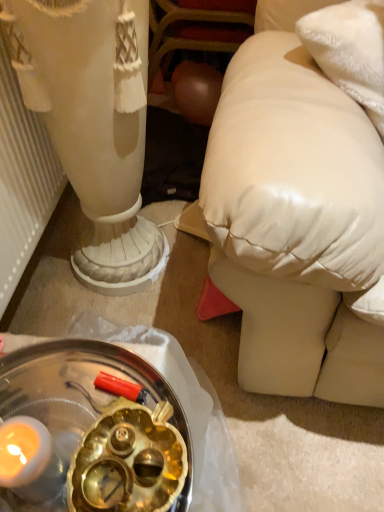
Locate an element on the screen. This screenshot has width=384, height=512. shiny metallic tray at lower left is located at coordinates (98, 430).

Measure the distance between shiny metallic tray at lower left and camera.

The depth of shiny metallic tray at lower left is 18.70 inches.

The image size is (384, 512). What do you see at coordinates (98, 430) in the screenshot?
I see `shiny metallic tray at lower left` at bounding box center [98, 430].

Measure the distance between satin white vase at center and camera.

satin white vase at center is 68.12 centimeters from camera.

Describe the element at coordinates (93, 123) in the screenshot. I see `satin white vase at center` at that location.

Image resolution: width=384 pixels, height=512 pixels. I want to click on satin white vase at center, so click(x=93, y=123).

Locate an element on the screen. This screenshot has width=384, height=512. shiny metallic tray at lower left is located at coordinates (98, 430).

Is shiny metallic tray at lower left at the left side of satin white vase at center?

No, shiny metallic tray at lower left is not to the left of satin white vase at center.

Which object is further away from the camera taking this photo, shiny metallic tray at lower left or satin white vase at center?

satin white vase at center is behind.

Which is behind, point (29, 367) or point (43, 115)?

Positioned behind is point (43, 115).

From the picture: From the image's perspective, does shiny metallic tray at lower left appear lower than satin white vase at center?

Correct, shiny metallic tray at lower left appears lower than satin white vase at center in the image.

From a real-world perspective, who is located higher, shiny metallic tray at lower left or satin white vase at center?

shiny metallic tray at lower left.

Considering the relative sizes of shiny metallic tray at lower left and satin white vase at center in the image provided, is shiny metallic tray at lower left thinner than satin white vase at center?

Yes.

Considering the sizes of objects shiny metallic tray at lower left and satin white vase at center in the image provided, who is shorter, shiny metallic tray at lower left or satin white vase at center?

With less height is shiny metallic tray at lower left.

Between shiny metallic tray at lower left and satin white vase at center, which one has larger size?

satin white vase at center is bigger.

In the scene shown: Is shiny metallic tray at lower left not within satin white vase at center?

Yes, shiny metallic tray at lower left is located beyond the bounds of satin white vase at center.

Is shiny metallic tray at lower left next to satin white vase at center and touching it?

shiny metallic tray at lower left and satin white vase at center are clearly separated.

Looking at this image, is shiny metallic tray at lower left aimed at satin white vase at center?

No, shiny metallic tray at lower left is not facing towards satin white vase at center.

Identify the location of sculpture on the left of shiny metallic tray at lower left. The height and width of the screenshot is (512, 384). (93, 123).

Visually, is satin white vase at center positioned to the left or to the right of shiny metallic tray at lower left?

Based on their positions, satin white vase at center is located to the left of shiny metallic tray at lower left.

Considering their positions, is satin white vase at center located in front of or behind shiny metallic tray at lower left?

satin white vase at center is behind shiny metallic tray at lower left.

Is point (96, 173) farther from camera compared to point (50, 403)?

Yes.

From the image's perspective, is satin white vase at center above shiny metallic tray at lower left?

Correct, satin white vase at center appears higher than shiny metallic tray at lower left in the image.

From a real-world perspective, between satin white vase at center and shiny metallic tray at lower left, who is vertically higher?

From a 3D spatial view, shiny metallic tray at lower left is above.

Which object is thinner, satin white vase at center or shiny metallic tray at lower left?

shiny metallic tray at lower left is thinner.

Does satin white vase at center have a lesser height compared to shiny metallic tray at lower left?

In fact, satin white vase at center may be taller than shiny metallic tray at lower left.

Can you confirm if satin white vase at center is bigger than shiny metallic tray at lower left?

Yes.

Is satin white vase at center surrounding shiny metallic tray at lower left?

No, shiny metallic tray at lower left is not inside satin white vase at center.

Is satin white vase at center far from shiny metallic tray at lower left?

No, satin white vase at center is in close proximity to shiny metallic tray at lower left.

From the picture: Could you tell me if satin white vase at center is facing shiny metallic tray at lower left?

No.

How different are the orientations of satin white vase at center and shiny metallic tray at lower left in degrees?

The facing directions of satin white vase at center and shiny metallic tray at lower left are 0.000774 degrees apart.

This screenshot has width=384, height=512. In order to click on sculpture on the left of shiny metallic tray at lower left in this screenshot , I will do `click(93, 123)`.

Find the location of a particular element. The image size is (384, 512). glass plate above the satin white vase at center (from a real-world perspective) is located at coordinates (98, 430).

Identify the location of glass plate below the satin white vase at center (from the image's perspective). Image resolution: width=384 pixels, height=512 pixels. (98, 430).